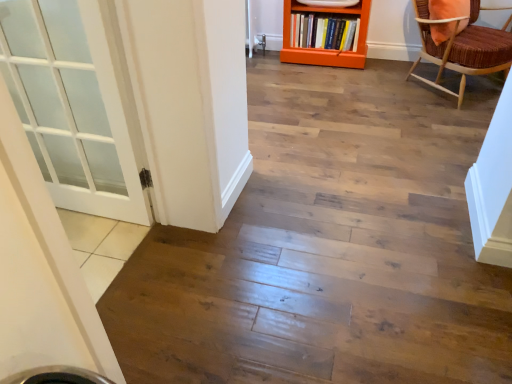
Question: Considering the positions of point (459, 64) and point (332, 21), is point (459, 64) closer or farther from the camera than point (332, 21)?

Choices:
 (A) farther
 (B) closer

Answer: (B)

Question: Relative to hardcover book at center, is brown woven chair at upper right in front or behind?

Choices:
 (A) behind
 (B) front

Answer: (B)

Question: Which of these objects is positioned farthest from the orange wood bookcase at upper center?

Choices:
 (A) hardcover book at center
 (B) brown woven chair at upper right

Answer: (B)

Question: Estimate the real-world distances between objects in this image. Which object is farther from the orange wood bookcase at upper center?

Choices:
 (A) hardcover book at center
 (B) brown woven chair at upper right

Answer: (B)